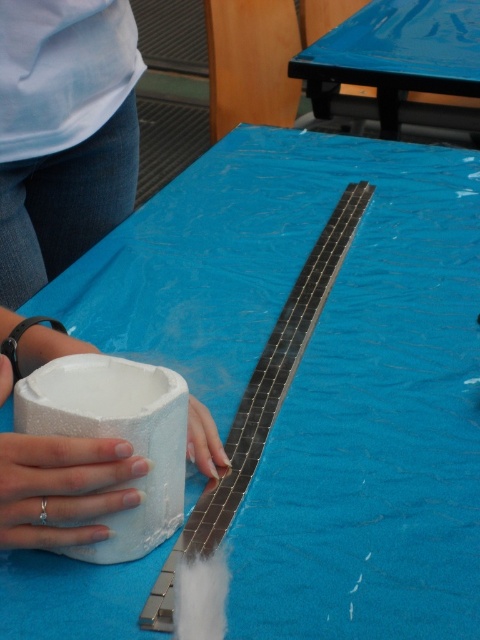
You are standing in front of a crafting table and want to place a small metallic tile on the blue glossy table at upper center. If your arm can reach 4 feet, can you comfortably place the tile on the table without moving closer?

The distance between you and the blue glossy table at upper center is 4.74 feet, which is slightly beyond your arm reach of 4 feet. You may need to move closer to comfortably place the tile.

You are a craftsperson working on a project and need to determine the position of two points on your table. Which point is closer to you, point (405, 68) or point (132, 472)?

Point (405, 68) is further to the viewer than point (132, 472), so the point closer to you is point (132, 472).